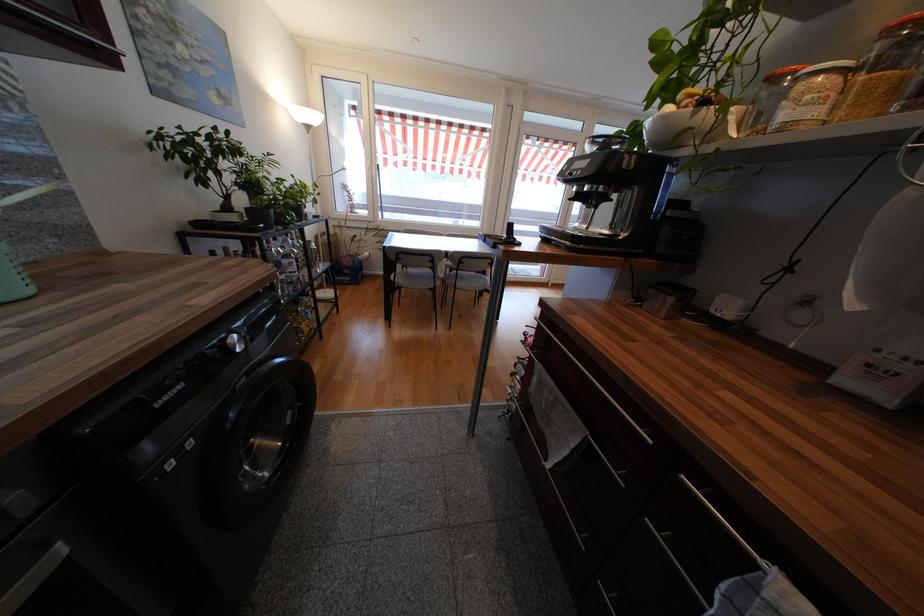
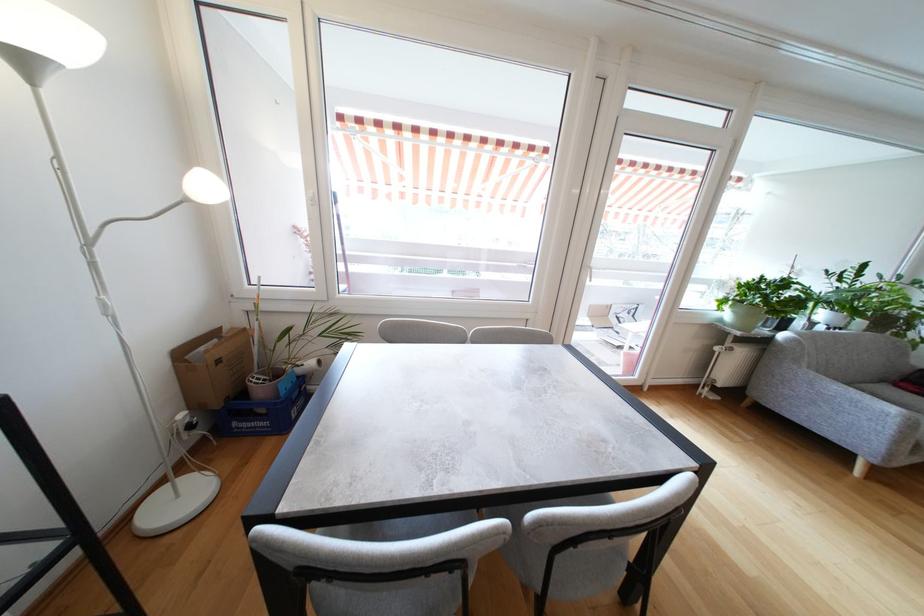
In the second image, find the point that corresponds to [339,283] in the first image.

(239, 432)